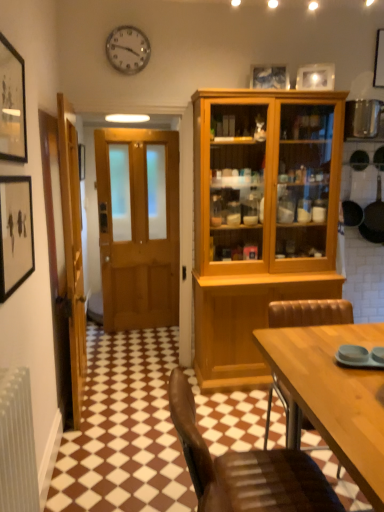
Image resolution: width=384 pixels, height=512 pixels. I want to click on unoccupied area behind brown wooden door at center, the 1th door in the right-to-left sequence, so click(x=139, y=352).